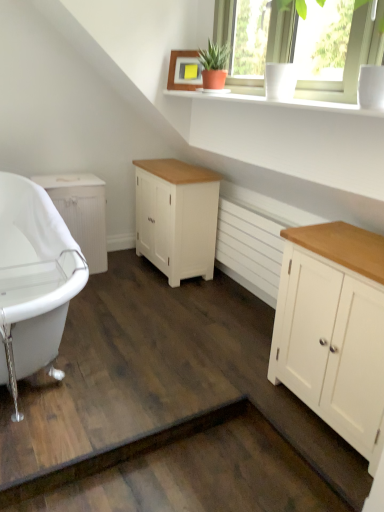
Locate an element on the screen. free point below white glossy cup at upper right (from a real-world perspective) is located at coordinates (238, 312).